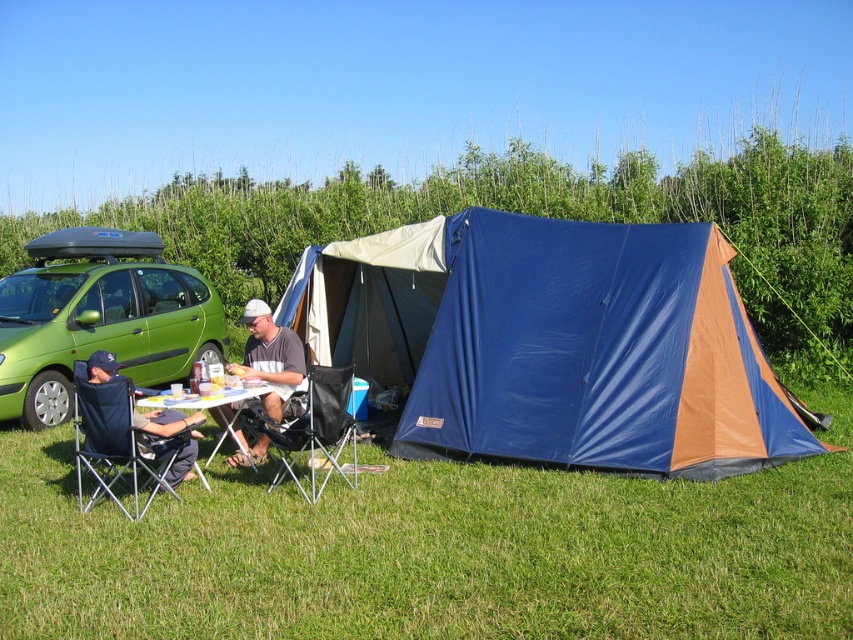
Question: Which point is farther from the camera taking this photo?

Choices:
 (A) (282, 476)
 (B) (206, 464)
 (C) (57, 273)
 (D) (155, 445)

Answer: (C)

Question: Where is dark blue fabric chair at lower left located in relation to white plastic table at lower center in the image?

Choices:
 (A) left
 (B) right

Answer: (A)

Question: Which of the following is the farthest from the observer?

Choices:
 (A) (144, 426)
 (B) (419, 406)
 (C) (294, 404)

Answer: (B)

Question: From the image, what is the correct spatial relationship of black fabric chair at center in relation to white fabric shirt at center?

Choices:
 (A) below
 (B) above

Answer: (A)

Question: Which object is positioned closest to the white fabric shirt at center?

Choices:
 (A) white plastic table at lower center
 (B) blue tarpaulin tent at center
 (C) green matte minivan at left

Answer: (A)

Question: Is blue tarpaulin tent at center above white plastic table at lower center?

Choices:
 (A) no
 (B) yes

Answer: (B)